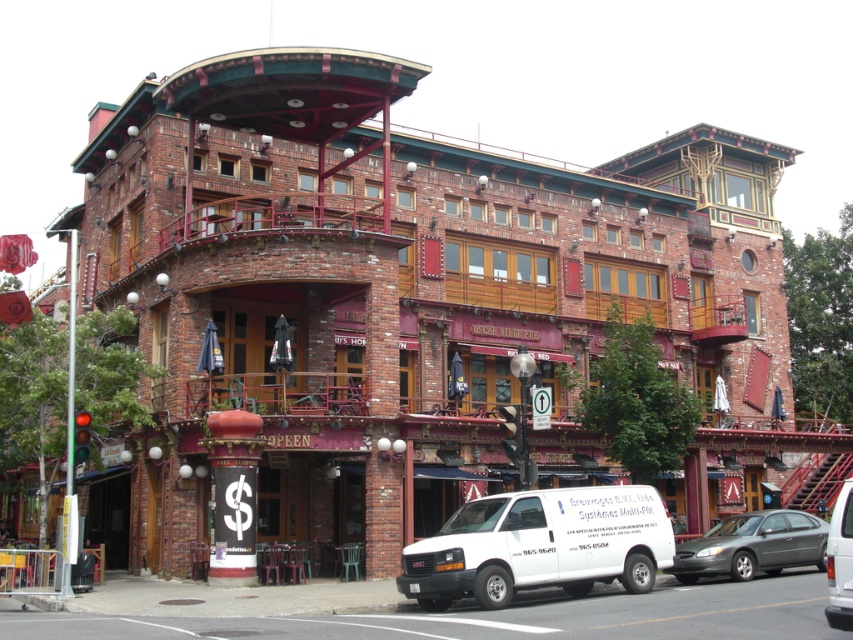
Looking at this image, you are a pedestrian standing in front of the multi story brick building with a balcony. You see a white matte van at lower center and a metallic gray sedan at lower right. Which vehicle is closer to the building?

The white matte van at lower center is to the left of the metallic gray sedan at lower right, so it is closer to the building.

Based on the photo, you are a delivery person trying to park your white matte van at lower center near the building. There is another white matte van at center already parked. Which van is shorter and can fit into a tighter parking spot?

The white matte van at lower center is shorter than the white matte van at center, so it can fit into a tighter parking spot.